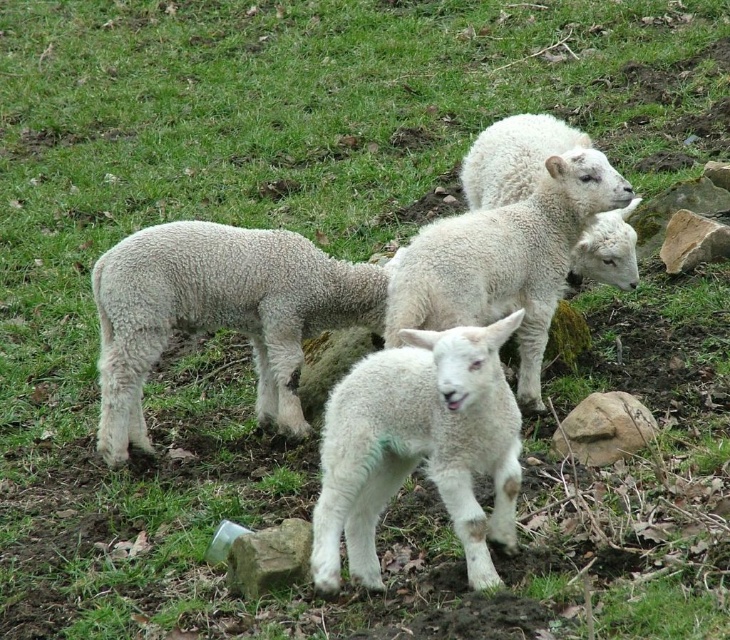
Question: Is white woolen lamb at center to the right of white woolen sheep at upper right from the viewer's perspective?

Choices:
 (A) no
 (B) yes

Answer: (A)

Question: Which point is farther to the camera?

Choices:
 (A) (672, 259)
 (B) (556, 150)
 (C) (149, 291)

Answer: (A)

Question: Which of the following is the farthest from the observer?

Choices:
 (A) green mossy rock at lower center
 (B) brown rough rock at lower right
 (C) white woolen lamb at center
 (D) white woolen sheep at upper center

Answer: (C)

Question: Among these objects, which one is nearest to the camera?

Choices:
 (A) smooth gray rock at right
 (B) white woolen lamb at center

Answer: (B)

Question: Considering the relative positions of white woolen lamb at center and brown rough rock at lower right in the image provided, where is white woolen lamb at center located with respect to brown rough rock at lower right?

Choices:
 (A) below
 (B) above

Answer: (B)

Question: Is white fluffy lamb at center further to the viewer compared to smooth gray rock at right?

Choices:
 (A) no
 (B) yes

Answer: (A)